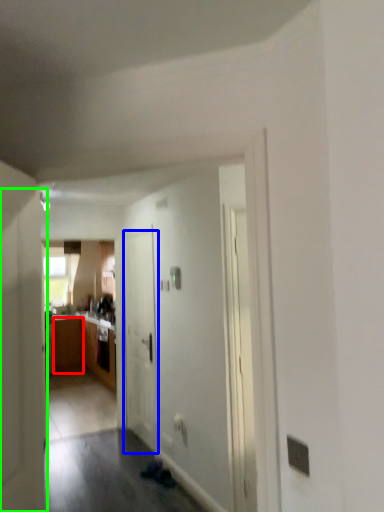
Question: Considering the real-world distances, which object is farthest from cabinetry (highlighted by a red box)? door (highlighted by a blue box) or door (highlighted by a green box)?

Choices:
 (A) door
 (B) door

Answer: (B)